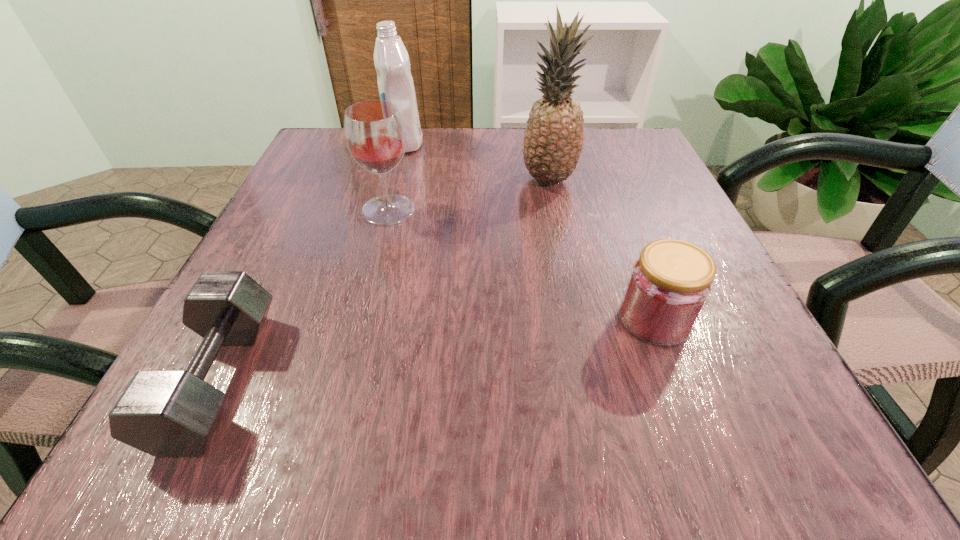
This screenshot has width=960, height=540. Identify the location of free space that satisfies the following two spatial constraints: 1. on the back side of the second farthest object; 2. on the right side of the dumbbell. (317, 179).

Where is `free spot that satisfies the following two spatial constraints: 1. on the front side of the jam; 2. on the left side of the third nearest object`? The width and height of the screenshot is (960, 540). free spot that satisfies the following two spatial constraints: 1. on the front side of the jam; 2. on the left side of the third nearest object is located at coordinates (361, 319).